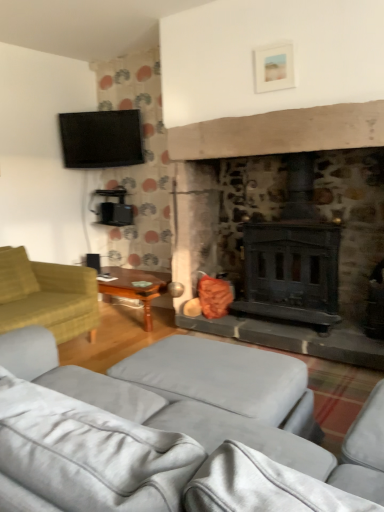
Question: From the image's perspective, would you say green fabric studio couch at left, placed as the second studio couch when sorted from front to back, is positioned over soft yellow pillow at left?

Choices:
 (A) yes
 (B) no

Answer: (B)

Question: From a real-world perspective, is green fabric studio couch at left, placed as the second studio couch when sorted from front to back, beneath soft yellow pillow at left?

Choices:
 (A) no
 (B) yes

Answer: (B)

Question: From the image's perspective, does green fabric studio couch at left, which is the 1th studio couch from back to front, appear lower than soft yellow pillow at left?

Choices:
 (A) yes
 (B) no

Answer: (A)

Question: Does green fabric studio couch at left, which is the 1th studio couch from back to front, have a smaller size compared to soft yellow pillow at left?

Choices:
 (A) yes
 (B) no

Answer: (B)

Question: Considering the relative sizes of green fabric studio couch at left, which is the 1th studio couch from back to front, and soft yellow pillow at left in the image provided, is green fabric studio couch at left, which is the 1th studio couch from back to front, wider than soft yellow pillow at left?

Choices:
 (A) yes
 (B) no

Answer: (A)

Question: In terms of height, does soft yellow pillow at left look taller or shorter compared to matte black tv at upper left?

Choices:
 (A) short
 (B) tall

Answer: (A)

Question: Considering the relative positions of soft yellow pillow at left and matte black tv at upper left in the image provided, is soft yellow pillow at left to the left or to the right of matte black tv at upper left?

Choices:
 (A) right
 (B) left

Answer: (B)

Question: From a real-world perspective, is soft yellow pillow at left physically located above or below matte black tv at upper left?

Choices:
 (A) above
 (B) below

Answer: (B)

Question: From the image's perspective, is soft yellow pillow at left positioned above or below matte black tv at upper left?

Choices:
 (A) above
 (B) below

Answer: (B)

Question: Considering the positions of wooden polished table at left and light gray fabric studio couch at lower center, the first studio couch when ordered from front to back, in the image, is wooden polished table at left bigger or smaller than light gray fabric studio couch at lower center, the first studio couch when ordered from front to back,?

Choices:
 (A) big
 (B) small

Answer: (B)

Question: From a real-world perspective, is wooden polished table at left physically located above or below light gray fabric studio couch at lower center, the first studio couch when ordered from front to back?

Choices:
 (A) above
 (B) below

Answer: (B)

Question: Is wooden polished table at left in front of or behind light gray fabric studio couch at lower center, the first studio couch when ordered from front to back, in the image?

Choices:
 (A) front
 (B) behind

Answer: (B)

Question: Looking at their shapes, would you say wooden polished table at left is wider or thinner than light gray fabric studio couch at lower center, arranged as the 2th studio couch when viewed from the back?

Choices:
 (A) thin
 (B) wide

Answer: (A)

Question: Is matte black tv at upper left to the left or to the right of green fabric studio couch at left, placed as the second studio couch when sorted from front to back, in the image?

Choices:
 (A) right
 (B) left

Answer: (A)

Question: From a real-world perspective, is matte black tv at upper left above or below green fabric studio couch at left, placed as the second studio couch when sorted from front to back?

Choices:
 (A) above
 (B) below

Answer: (A)